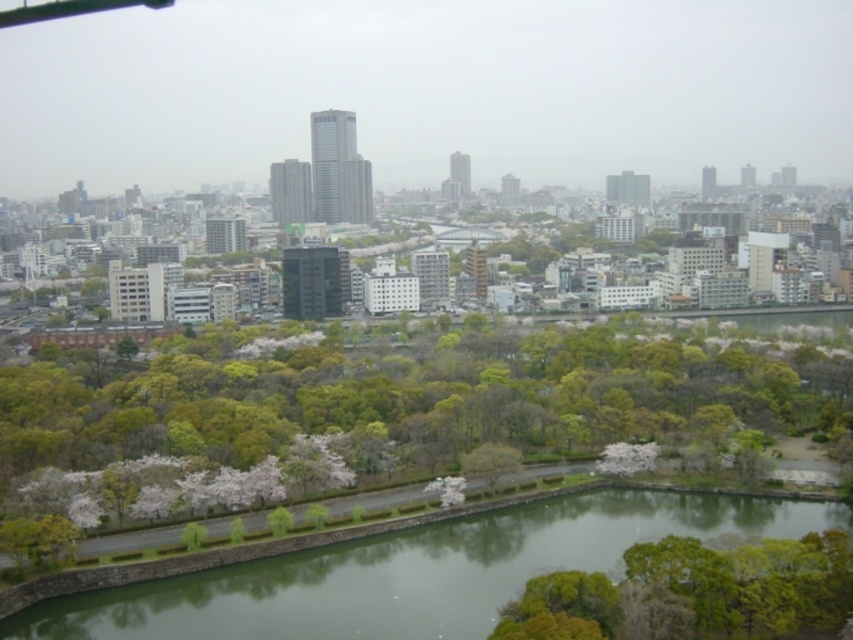
Which is more to the right, green leafy tree at center or green leafy tree at lower right?

Positioned to the right is green leafy tree at center.

Between point (49, 348) and point (618, 596), which one is positioned behind?

Point (49, 348)

The image size is (853, 640). What are the coordinates of `green leafy tree at center` in the screenshot? It's located at (421, 397).

Is green leafy tree at center shorter than green smooth water at center?

No, green leafy tree at center is not shorter than green smooth water at center.

Does point (198, 348) lie in front of point (490, 602)?

No, it is behind (490, 602).

This screenshot has height=640, width=853. Find the location of `green leafy tree at center`. green leafy tree at center is located at coordinates (421, 397).

Does green smooth water at center appear under green leafy tree at lower right?

Indeed, green smooth water at center is positioned under green leafy tree at lower right.

Between point (792, 522) and point (654, 632), which one is positioned behind?

Positioned behind is point (792, 522).

Is point (381, 636) positioned before point (757, 552)?

No, it is behind (757, 552).

Where is `green smooth water at center`? Image resolution: width=853 pixels, height=640 pixels. green smooth water at center is located at coordinates (415, 572).